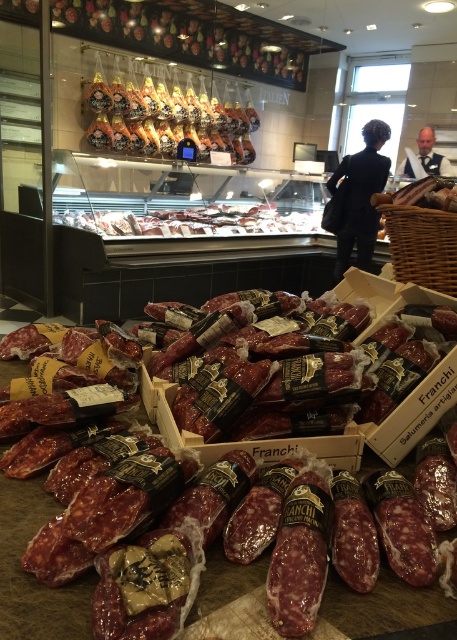
You are a customer standing in front of the deli counter. You see the shiny brown ham at upper center and the matte brown meat at center. Which one is closer to you?

The shiny brown ham at upper center is closer to you because it is further to the viewer than the matte brown meat at center.

You are a customer standing in the deli and want to grab the shiny brown ham at upper center. The store has a rule that you must stay at least 15 feet away from the display case. Can you reach the ham without violating the rule?

The shiny brown ham at upper center is 16.03 feet away from the viewer, which is more than the required 15 feet distance. Therefore, you can reach it without violating the store rule.

You are a customer in the deli and want to buy a ham that is not too thick. Which of the two hams, the shiny brown ham at upper center or the matte brown meat at center, should you choose?

The shiny brown ham at upper center is thinner than the matte brown meat at center, so you should choose the shiny brown ham at upper center.